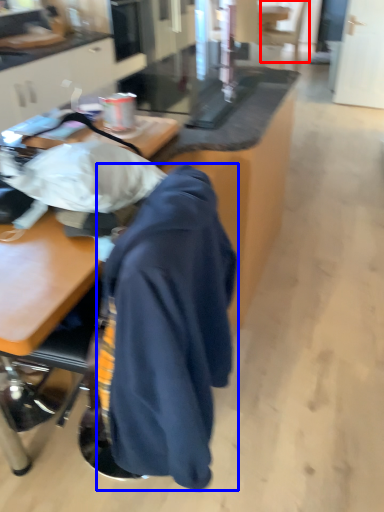
Question: Among these objects, which one is farthest to the camera, swivel chair (highlighted by a red box) or cloak (highlighted by a blue box)?

Choices:
 (A) swivel chair
 (B) cloak

Answer: (A)